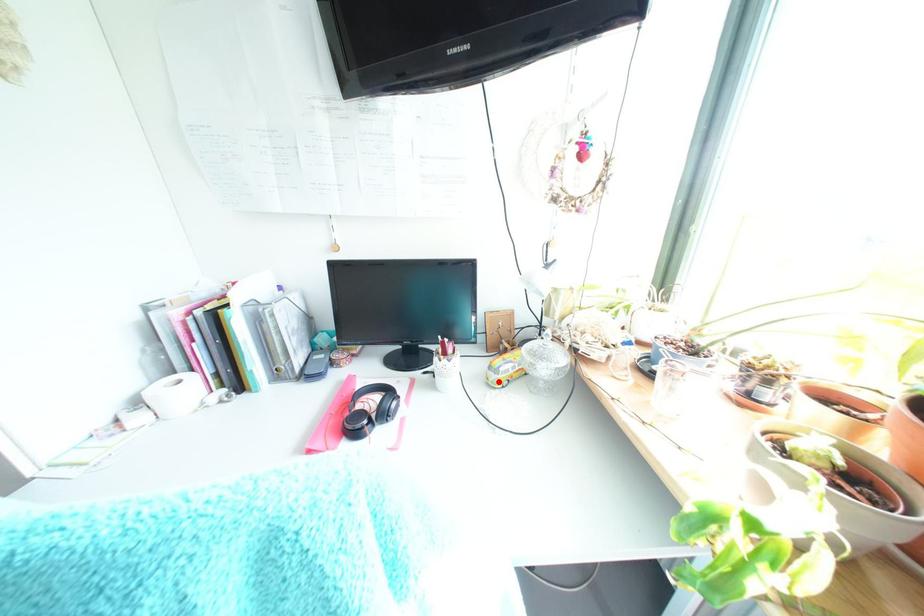
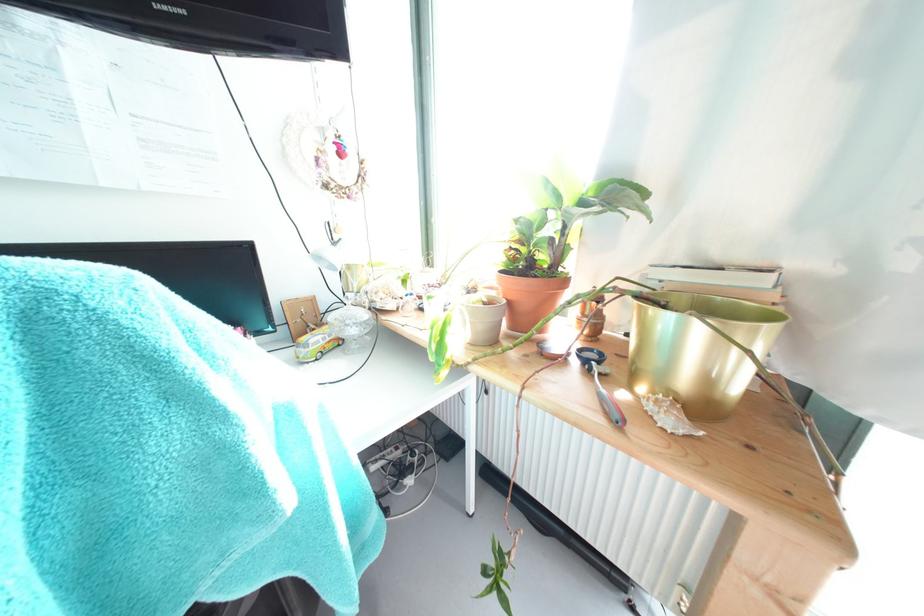
Find the pixel in the second image that matches the highlighted location in the first image.

(309, 358)